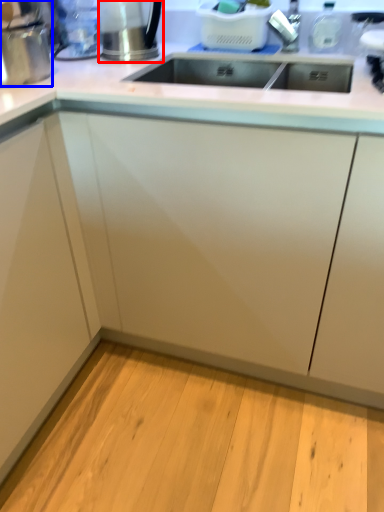
Question: Among these objects, which one is nearest to the camera, appliance (highlighted by a red box) or appliance (highlighted by a blue box)?

Choices:
 (A) appliance
 (B) appliance

Answer: (B)